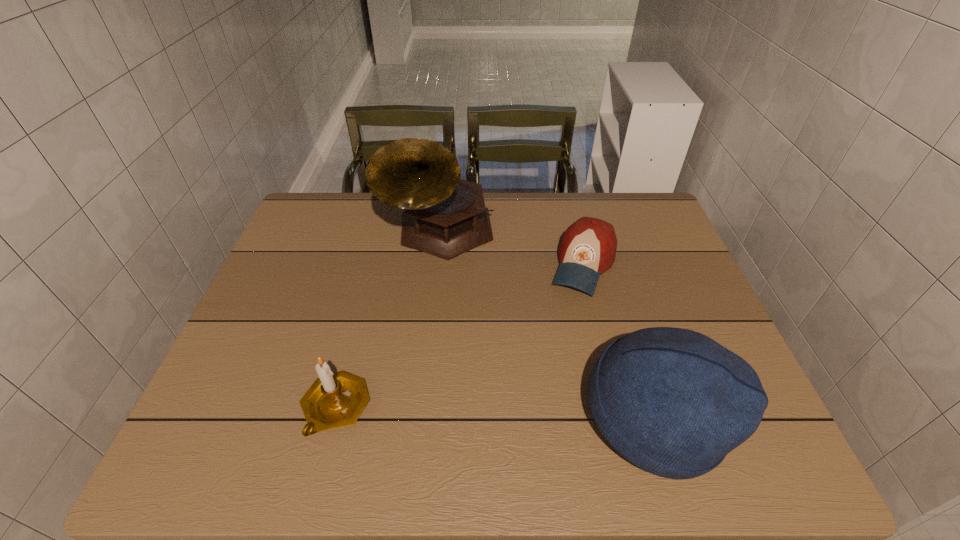
Image resolution: width=960 pixels, height=540 pixels. I want to click on free spot located 0.270m on the horn direction of the phonograph record, so click(444, 349).

Where is `baseball cap at the far edge`? This screenshot has height=540, width=960. baseball cap at the far edge is located at coordinates click(587, 249).

Where is `phonograph record that is at the far edge`? The width and height of the screenshot is (960, 540). phonograph record that is at the far edge is located at coordinates (445, 216).

Image resolution: width=960 pixels, height=540 pixels. In order to click on candle holder that is positioned at the near edge in this screenshot , I will do `click(334, 400)`.

Identify the location of skullcap present at the near edge. This screenshot has height=540, width=960. (673, 402).

Find the location of a particular element. The image size is (960, 540). object at the right edge is located at coordinates (673, 402).

Where is `object that is at the near right corner`? object that is at the near right corner is located at coordinates (673, 402).

The image size is (960, 540). I want to click on free region at the far edge, so click(539, 231).

At what (x,y) coordinates should I click in order to perform the action: click on free space at the near edge. Please return your answer as a coordinate pair (x, y). The height and width of the screenshot is (540, 960). Looking at the image, I should click on (553, 401).

In the image, there is a desktop. What are the coordinates of `free space at the left edge` in the screenshot? It's located at (320, 280).